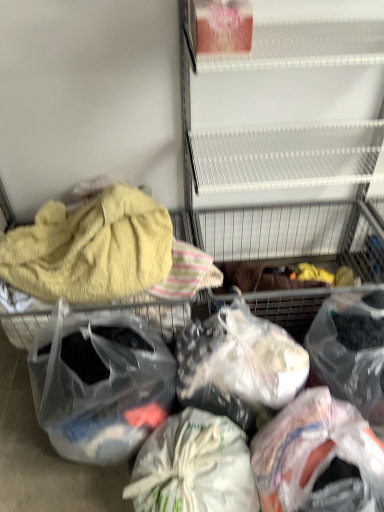
Question: Relative to translucent plastic bag at center, the 3th plastic bag from the right, is white fabric bag at center, which is the second plastic bag in left-to-right order, in front or behind?

Choices:
 (A) front
 (B) behind

Answer: (A)

Question: From the image's perspective, is white fabric bag at center, which is the second plastic bag in left-to-right order, located above or below translucent plastic bag at center, acting as the 3th plastic bag starting from the left?

Choices:
 (A) below
 (B) above

Answer: (A)

Question: Based on their relative distances, which object is farther from the translucent plastic bag at lower right, which is the 2th plastic bag from right to left?

Choices:
 (A) translucent plastic bag at lower right, positioned as the 5th plastic bag in left-to-right order
 (B) white fabric bag at center, acting as the 4th plastic bag starting from the right
 (C) translucent plastic bag at center, the 3th plastic bag from the right
 (D) transparent plastic bag at center, the first plastic bag when ordered from left to right
 (E) yellow fluffy towel at left

Answer: (E)

Question: Which object is the farthest from the transparent plastic bag at center, the first plastic bag when ordered from left to right?

Choices:
 (A) translucent plastic bag at lower right, which is the 2th plastic bag from right to left
 (B) translucent plastic bag at center, the 3th plastic bag from the right
 (C) translucent plastic bag at lower right, positioned as the 1th plastic bag in right-to-left order
 (D) white fabric bag at center, acting as the 4th plastic bag starting from the right
 (E) yellow fluffy towel at left

Answer: (C)